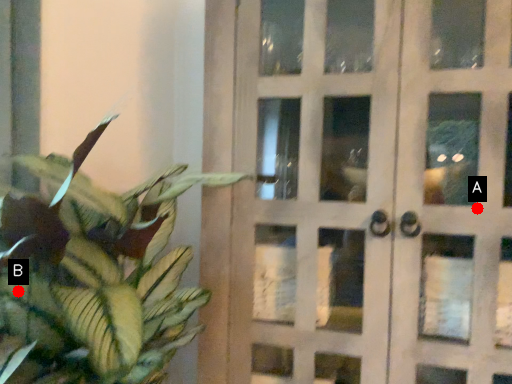
Question: Two points are circled on the image, labeled by A and B beside each circle. Which point is closer to the camera taking this photo?

Choices:
 (A) A is closer
 (B) B is closer

Answer: (B)